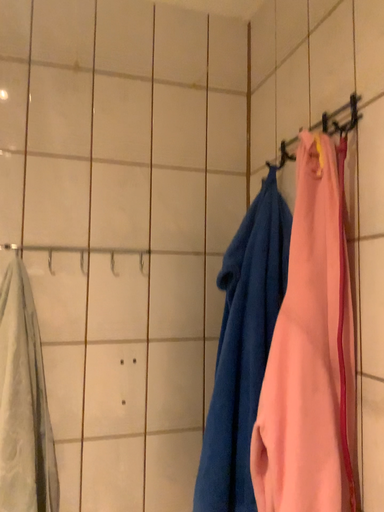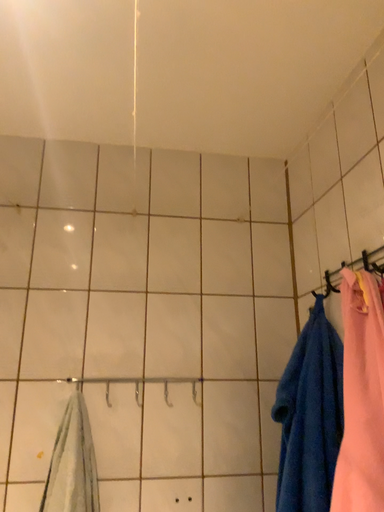
Question: How did the camera likely rotate when shooting the video?

Choices:
 (A) rotated upward
 (B) rotated downward

Answer: (A)